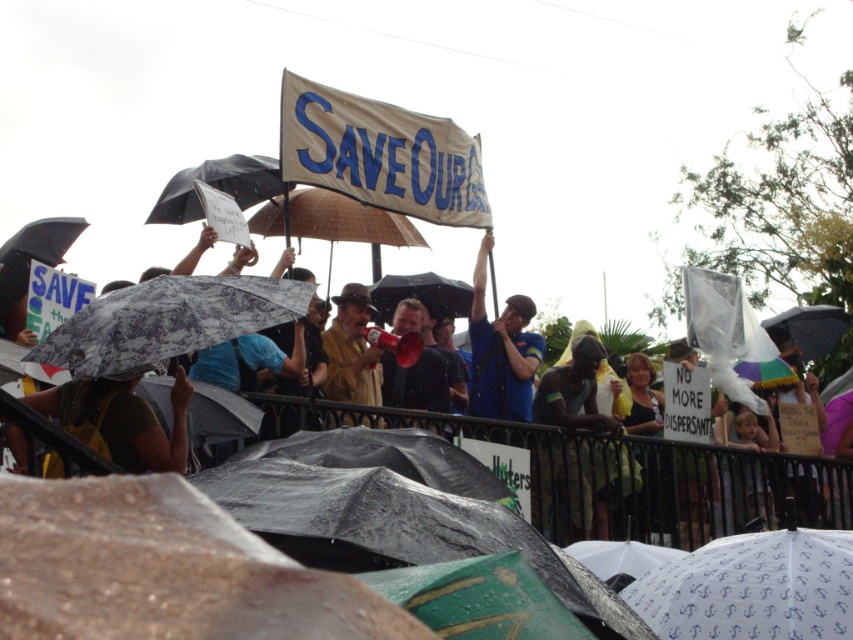
This screenshot has height=640, width=853. Describe the element at coordinates (120, 420) in the screenshot. I see `green matte shirt at lower left` at that location.

Which of these two, green matte shirt at lower left or dark skin figure at center, stands shorter?

With less height is green matte shirt at lower left.

In order to click on green matte shirt at lower left in this screenshot , I will do [x=120, y=420].

The height and width of the screenshot is (640, 853). I want to click on green matte shirt at lower left, so click(120, 420).

Which of these two, brown leather jacket at center or dark blue shirt at center, stands shorter?

dark blue shirt at center is shorter.

Find the location of a particular element. This screenshot has height=640, width=853. brown leather jacket at center is located at coordinates pos(351,349).

Identify the location of brown leather jacket at center. Image resolution: width=853 pixels, height=640 pixels. (351, 349).

From the picture: Is green matte shirt at lower left taller than brown leather jacket at center?

Incorrect, green matte shirt at lower left's height is not larger of brown leather jacket at center's.

Which is behind, point (173, 467) or point (351, 346)?

The point (351, 346) is more distant.

This screenshot has width=853, height=640. In order to click on green matte shirt at lower left in this screenshot , I will do `click(120, 420)`.